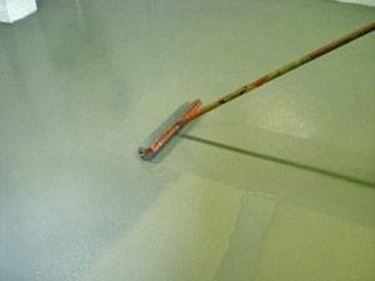
The width and height of the screenshot is (375, 281). I want to click on furniture reflection, so click(x=75, y=38).